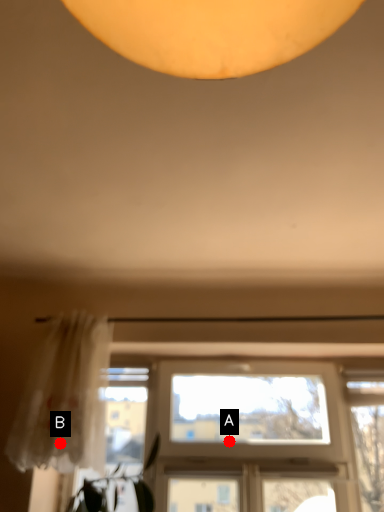
Question: Two points are circled on the image, labeled by A and B beside each circle. Which point is closer to the camera?

Choices:
 (A) A is closer
 (B) B is closer

Answer: (B)